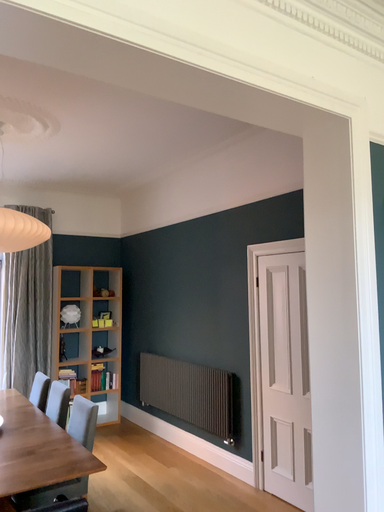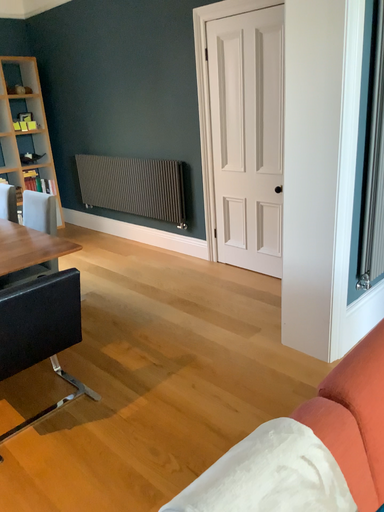
Question: How did the camera likely rotate when shooting the video?

Choices:
 (A) rotated downward
 (B) rotated upward

Answer: (A)